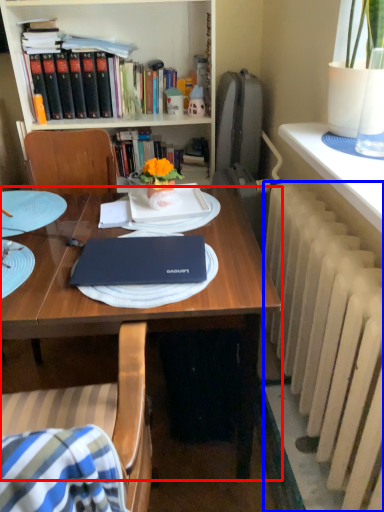
Question: Which object appears farthest to the camera in this image, desk (highlighted by a red box) or radiator (highlighted by a blue box)?

Choices:
 (A) desk
 (B) radiator

Answer: (A)